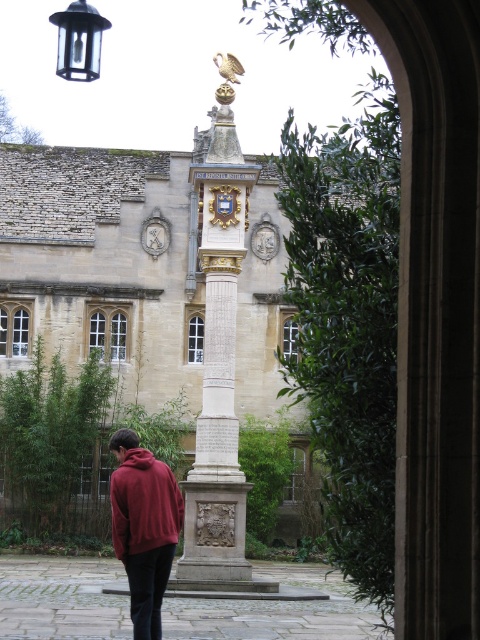
You are a visitor in the courtyard and want to take a photo of the gold polished stone column at center and the maroon fleece jacket at lower left. Which object should you focus on first if you want to capture both in a single frame without moving the camera?

You should focus on the gold polished stone column at center first because it is taller than the maroon fleece jacket at lower left, so it will occupy more space in the frame and ensure both are visible.

You are a visitor standing at the maroon fleece jacket at lower left position in the courtyard. You want to take a photo of the gold polished stone column at center. Will you need to move closer to get a clear shot, given that your camera has a maximum zoom range of 15 meters?

The gold polished stone column at center is 17.51 meters away from the maroon fleece jacket at lower left. Since your camera can only zoom up to 15 meters, you will need to move closer to capture a clear photo of the gold polished stone column at center.